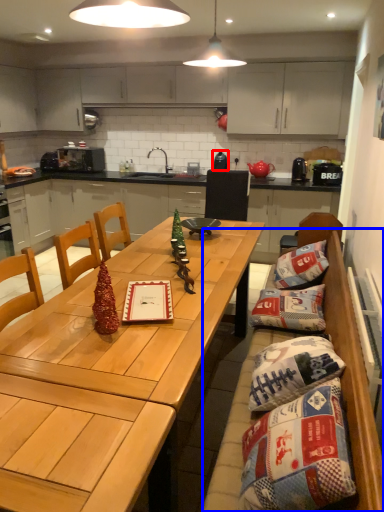
Question: Among these objects, which one is nearest to the camera, appliance (highlighted by a red box) or bean bag chair (highlighted by a blue box)?

Choices:
 (A) appliance
 (B) bean bag chair

Answer: (B)